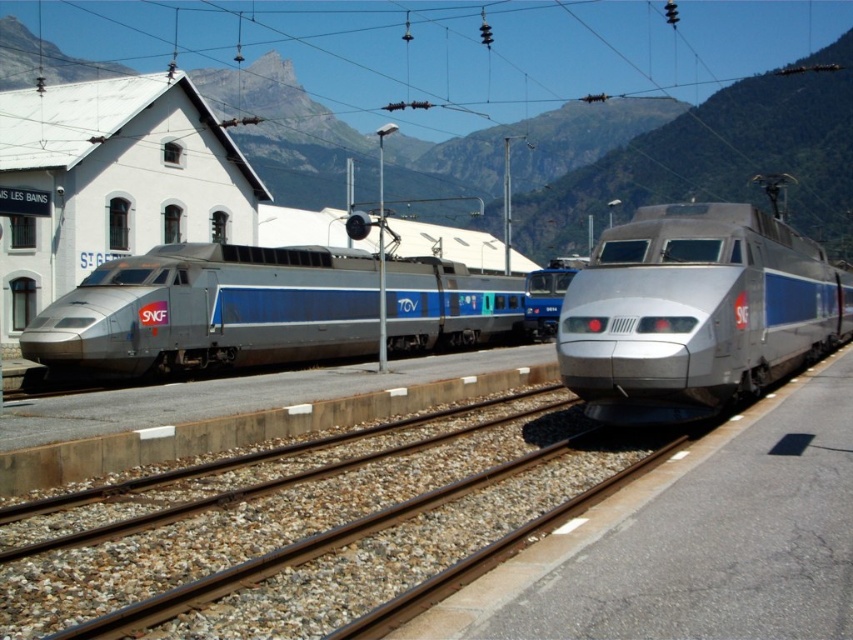
You are a maintenance worker needing to inspect both the metallic silver train at center and the silver metallic bullet train at center. If your ladder is 10 meters long, can you safely reach between them to move tools without having to move the ladder?

The distance between the metallic silver train at center and the silver metallic bullet train at center is 10.91 meters. Since the ladder is only 10 meters long, it is not long enough to safely span the gap between them. You would need a longer ladder or alternative method to transfer tools safely.

You are a passenger at the St. Gervais train station. You need to board the wider train between the metallic silver train at center and the silver metallic bullet train at center. Which one should you go to?

The metallic silver train at center is wider than the silver metallic bullet train at center, so you should board the metallic silver train at center to find the wider option.

You are a passenger at the St. Gervais train station. You need to board the taller train. Which one should you choose between the metallic silver train at center and the silver metallic bullet train at center?

The metallic silver train at center is taller than the silver metallic bullet train at center, so you should choose the metallic silver train at center.